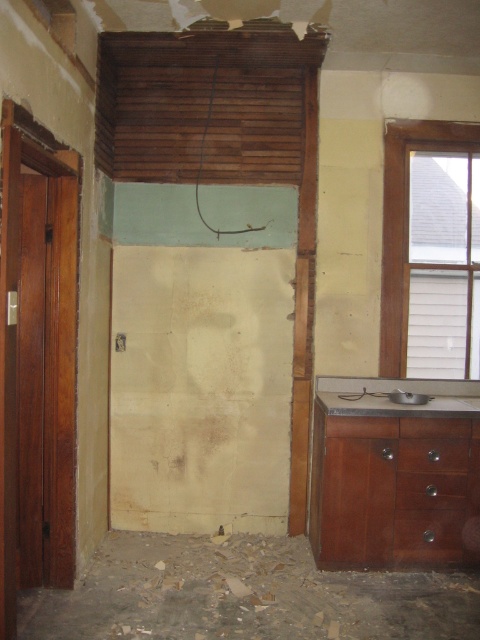
Between point (395, 184) and point (407, 400), which one is positioned in front?

Point (407, 400)

Who is lower down, clear glass window at upper right or satin silver sink at lower right?

satin silver sink at lower right is lower down.

Is point (393, 212) less distant than point (414, 394)?

That is False.

This screenshot has width=480, height=640. What are the coordinates of `clear glass window at upper right` in the screenshot? It's located at (407, 221).

Between clear glass window at upper right and brown wooden drawer at lower right, which one is positioned higher?

clear glass window at upper right

Does clear glass window at upper right have a lesser width compared to brown wooden drawer at lower right?

No, clear glass window at upper right is not thinner than brown wooden drawer at lower right.

Is point (469, 138) less distant than point (432, 451)?

No, (469, 138) is behind (432, 451).

At what (x,y) coordinates should I click in order to perform the action: click on clear glass window at upper right. Please return your answer as a coordinate pair (x, y). This screenshot has height=640, width=480. Looking at the image, I should click on [x=407, y=221].

Looking at this image, is brown wooden drawer at lower right wider than satin silver sink at lower right?

Indeed, brown wooden drawer at lower right has a greater width compared to satin silver sink at lower right.

Between brown wooden drawer at lower right and satin silver sink at lower right, which one is positioned lower?

brown wooden drawer at lower right

What do you see at coordinates (432, 454) in the screenshot?
I see `brown wooden drawer at lower right` at bounding box center [432, 454].

Find the location of a particular element. This screenshot has width=480, height=640. brown wooden drawer at lower right is located at coordinates (432, 454).